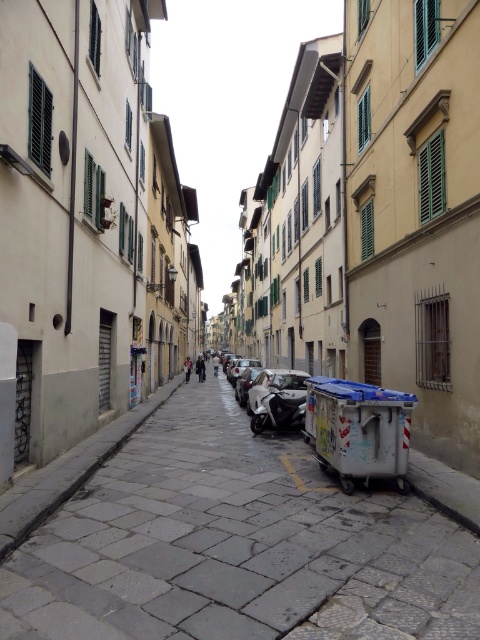
Question: Estimate the real-world distances between objects in this image. Which object is farther from the silver metallic car at center?

Choices:
 (A) shiny silver car at center
 (B) gray stone pavement at center
 (C) metallic silver scooter at center
 (D) shiny silver motorcycle at center

Answer: (B)

Question: Which of the following is the farthest from the observer?

Choices:
 (A) (240, 380)
 (B) (302, 392)
 (C) (267, 403)

Answer: (A)

Question: Among these points, which one is farthest from the camera?

Choices:
 (A) click(x=235, y=388)
 (B) click(x=241, y=369)
 (C) click(x=253, y=428)
 (D) click(x=297, y=545)

Answer: (B)

Question: Is silver metallic car at center behind shiny silver car at center?

Choices:
 (A) no
 (B) yes

Answer: (A)

Question: Does gray stone pavement at center come in front of shiny silver car at center?

Choices:
 (A) yes
 (B) no

Answer: (A)

Question: Does gray stone pavement at center appear over shiny silver car at center?

Choices:
 (A) yes
 (B) no

Answer: (A)